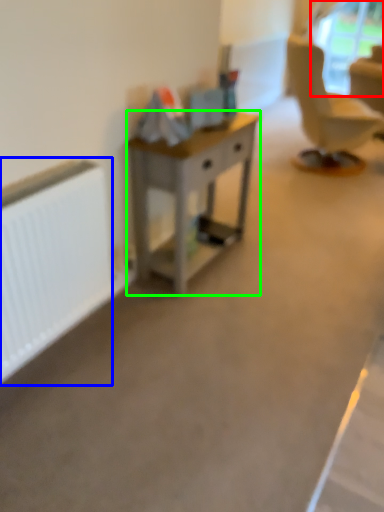
Question: Estimate the real-world distances between objects in this image. Which object is farther from window screen (highlighted by a red box), radiator (highlighted by a blue box) or desk (highlighted by a green box)?

Choices:
 (A) radiator
 (B) desk

Answer: (A)